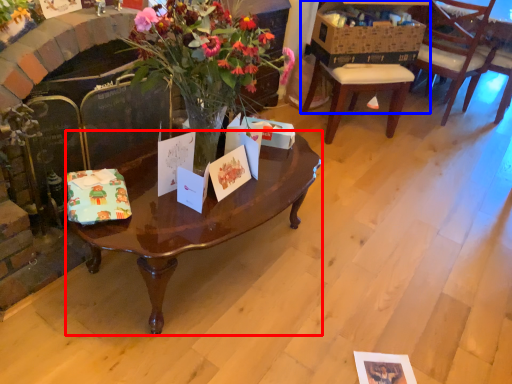
Question: Which of the following is the farthest to the observer, coffee table (highlighted by a red box) or desk (highlighted by a blue box)?

Choices:
 (A) coffee table
 (B) desk

Answer: (B)